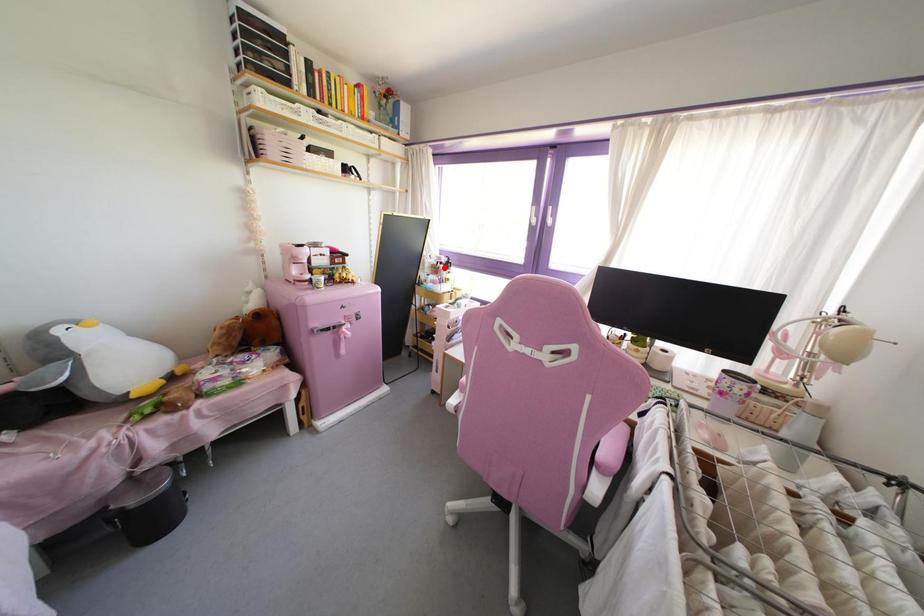
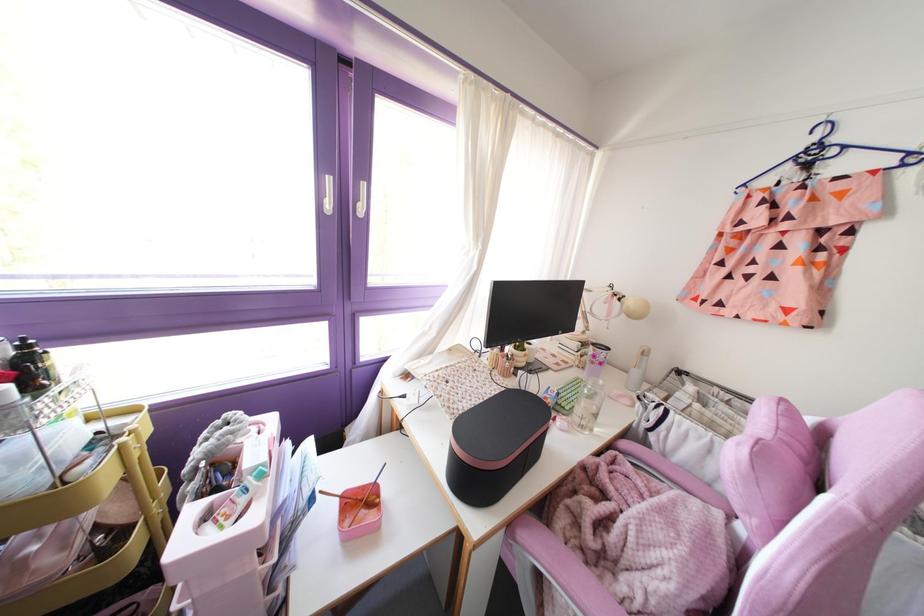
Question: I am providing you with two images of the same scene from different viewpoints. A red point is shown in image1. For the corresponding object point in image2, is it positioned nearer or farther from the camera?

Choices:
 (A) Nearer
 (B) Farther

Answer: (B)